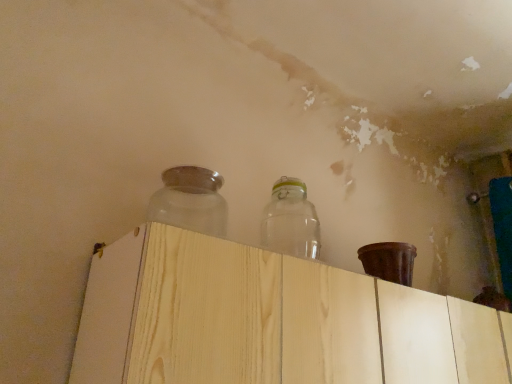
Question: From a real-world perspective, is frosted glass jar at upper center, the 1th bottle viewed from the left, physically located above or below transparent glass jar at upper center, the 2th bottle when ordered from left to right?

Choices:
 (A) below
 (B) above

Answer: (A)

Question: Do you think frosted glass jar at upper center, positioned as the second bottle in right-to-left order, is within transparent glass jar at upper center, arranged as the first bottle when viewed from the right, or outside of it?

Choices:
 (A) outside
 (B) inside

Answer: (A)

Question: Which object is positioned farthest from the frosted glass jar at upper center, the 1th bottle viewed from the left?

Choices:
 (A) light wood dresser at center
 (B) transparent glass jar at upper center, the 2th bottle when ordered from left to right

Answer: (A)

Question: Considering the real-world distances, which object is farthest from the frosted glass jar at upper center, positioned as the second bottle in right-to-left order?

Choices:
 (A) light wood dresser at center
 (B) transparent glass jar at upper center, arranged as the first bottle when viewed from the right

Answer: (A)